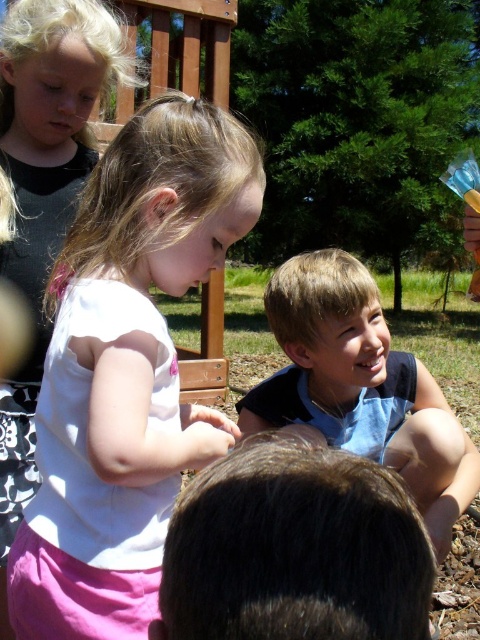
Question: Considering the real-world distances, which object is farthest from the white matte shirt at upper left?

Choices:
 (A) blue cotton shirt at lower right
 (B) brown hair at lower center
 (C) white matte shirt at center

Answer: (B)

Question: Is brown hair at lower center bigger than blue cotton shirt at lower right?

Choices:
 (A) no
 (B) yes

Answer: (A)

Question: Which of the following is the farthest from the observer?

Choices:
 (A) (424, 388)
 (B) (49, 550)
 (C) (379, 595)

Answer: (A)

Question: Does brown hair at lower center have a lesser width compared to white matte shirt at upper left?

Choices:
 (A) yes
 (B) no

Answer: (A)

Question: Does white matte shirt at center have a larger size compared to white matte shirt at upper left?

Choices:
 (A) no
 (B) yes

Answer: (B)

Question: Among these objects, which one is farthest from the camera?

Choices:
 (A) white matte shirt at upper left
 (B) blue cotton shirt at lower right
 (C) white matte shirt at center

Answer: (A)